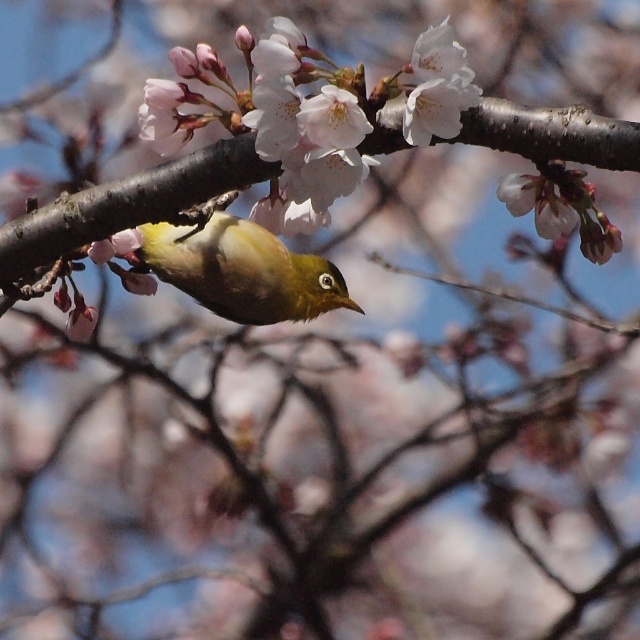
You are a photographer trying to capture the green matte bird at center and the smooth white petal at center in the same frame. Based on their sizes, which object would you need to focus on more carefully to ensure it fits entirely within the photo?

The green matte bird at center might be wider than the smooth white petal at center, so you should focus more on ensuring the bird fits entirely within the photo.

You are a photographer trying to capture the green matte bird at center and the smooth white petal at center in a single frame. Based on their positions, which object should you adjust your camera focus to first to ensure both are in the frame?

The green matte bird at center is to the left of the smooth white petal at center. Since the bird is positioned to the left, you should first focus on the green matte bird at center to ensure it stays within the frame while adjusting for the petal.

Where is the green matte bird at center located in terms of coordinates?

The green matte bird at center is located at point [240,269].